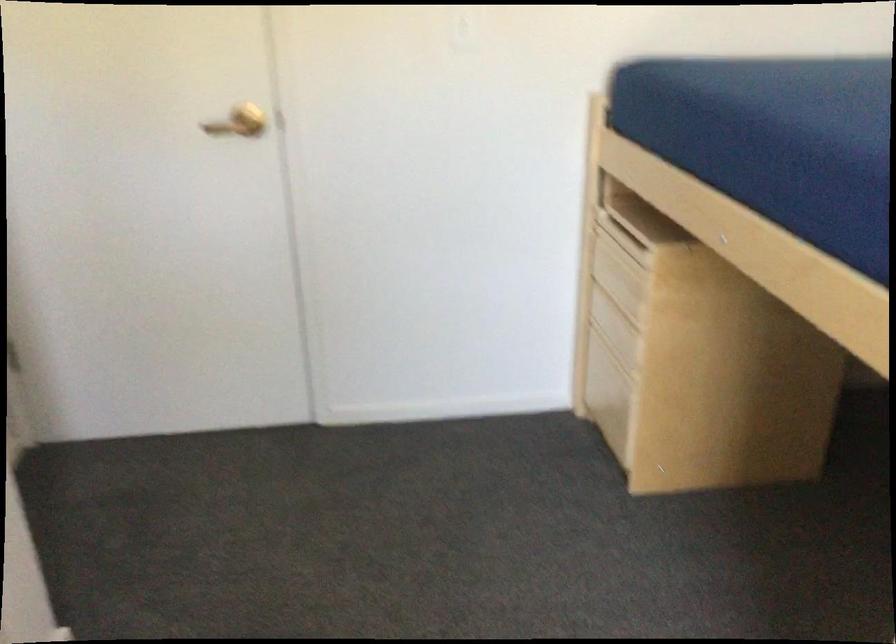
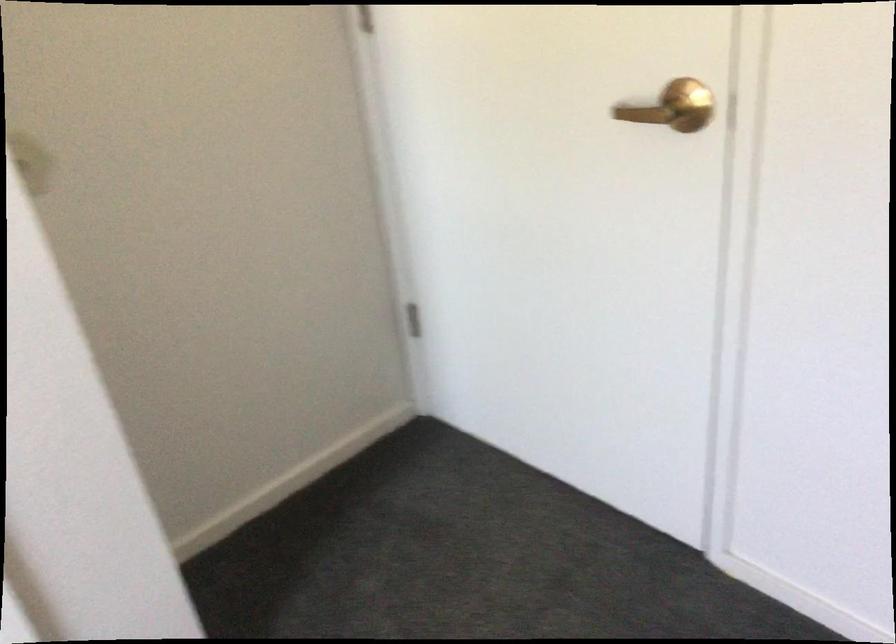
Find the pixel in the second image that matches the point at 244,122 in the first image.

(673, 107)